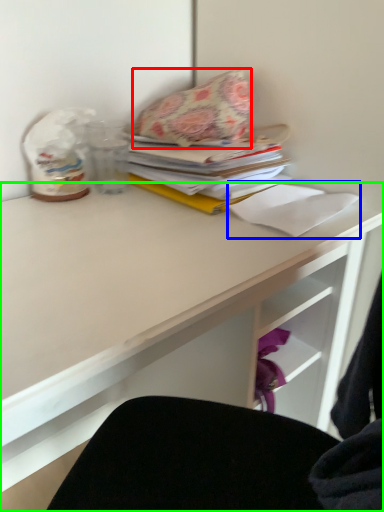
Question: Which object is the farthest from throw pillow (highlighted by a red box)? Choose among these: paper (highlighted by a blue box) or desk (highlighted by a green box).

Choices:
 (A) paper
 (B) desk

Answer: (B)